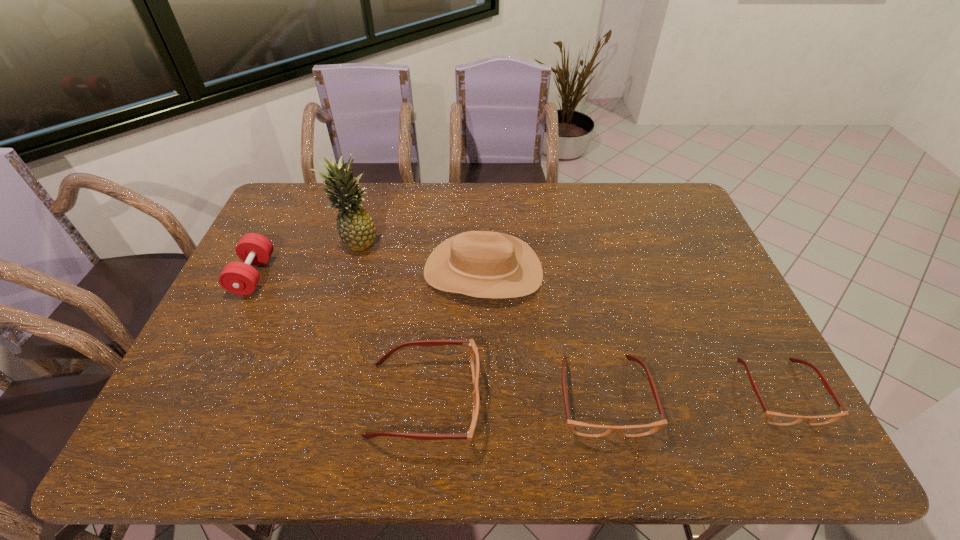
Identify the location of the leftmost spectacles. This screenshot has width=960, height=540. pos(474,356).

The image size is (960, 540). Identify the location of the fifth tallest object. (579, 428).

Find the location of a particular element. This screenshot has height=540, width=960. the second spectacles from left to right is located at coordinates (579, 428).

Identify the location of the shortest spectacles. The width and height of the screenshot is (960, 540). (774, 418).

Identify the location of the shortest object. The height and width of the screenshot is (540, 960). (774, 418).

Where is `pineapple`? pineapple is located at coordinates (x=355, y=226).

Identify the location of the second object from left to right. (355, 226).

At what (x,y) coordinates should I click in order to perform the action: click on dumbbell. Please return your answer as a coordinate pair (x, y). The height and width of the screenshot is (540, 960). Looking at the image, I should click on (239, 278).

The height and width of the screenshot is (540, 960). Identify the location of the third tallest object. (239, 278).

Locate an element on the screen. cowboy hat is located at coordinates (485, 264).